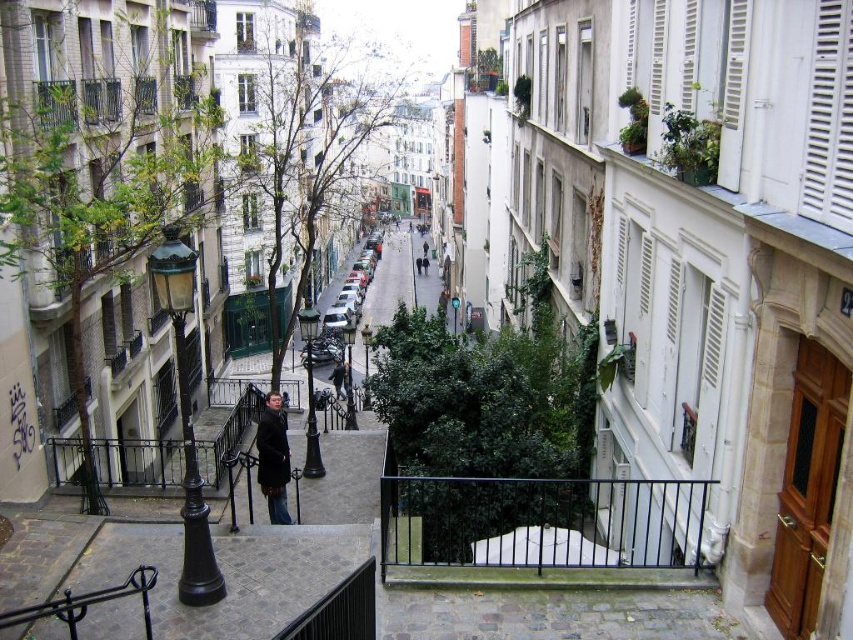
Measure the distance between black metal balustrade at center and white louvered shutter at upper right.

A distance of 10.18 meters exists between black metal balustrade at center and white louvered shutter at upper right.

Who is more distant from viewer, (437,548) or (840,193)?

Point (437,548)

Between point (463, 532) and point (834, 58), which one is positioned behind?

Point (463, 532)

Locate an element on the screen. The image size is (853, 640). black metal balustrade at center is located at coordinates (543, 522).

Between white louvered shutter at upper right and dark brown leather coat at center, which one is positioned lower?

dark brown leather coat at center

Between white louvered shutter at upper right and dark brown leather coat at center, which one appears on the right side from the viewer's perspective?

white louvered shutter at upper right

Is point (828, 189) less distant than point (283, 474)?

That is True.

What are the coordinates of `white louvered shutter at upper right` in the screenshot? It's located at (828, 120).

How much distance is there between black metal balustrade at center and dark brown leather coat at center?

They are 8.08 meters apart.

Is black metal balustrade at center to the right of dark brown leather coat at center from the viewer's perspective?

Correct, you'll find black metal balustrade at center to the right of dark brown leather coat at center.

Is point (434, 483) farther from viewer compared to point (271, 522)?

That is False.

Locate an element on the screen. The width and height of the screenshot is (853, 640). black metal balustrade at center is located at coordinates (543, 522).